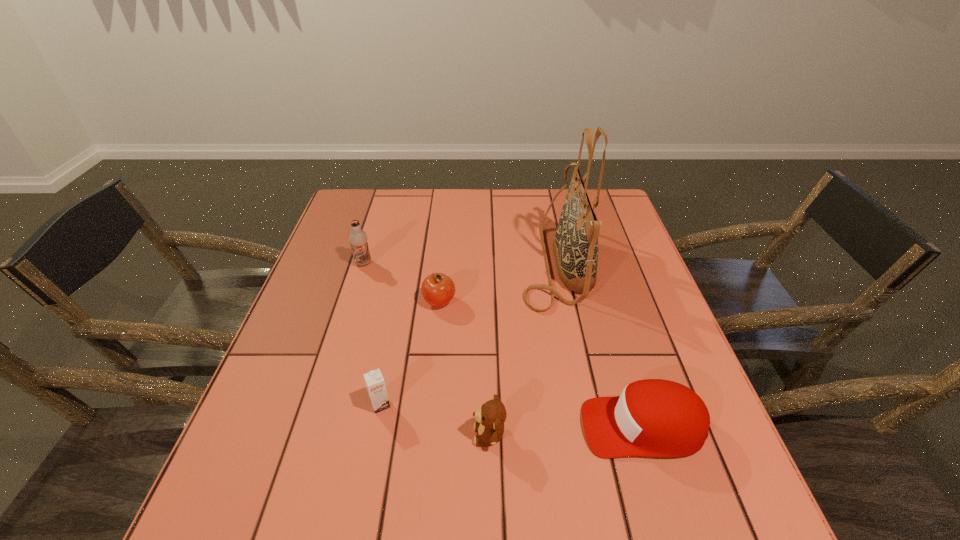
Find the location of a particular element. vacant space located on the front-facing side of the tallest object is located at coordinates (502, 262).

The image size is (960, 540). Identify the location of vacant position located 0.090m on the back of the farther chocolate milk. point(372,239).

Find the location of `vacant space situated on the back of the apple`. vacant space situated on the back of the apple is located at coordinates (444, 249).

The width and height of the screenshot is (960, 540). Find the location of `vacant point located on the front-facing side of the baseball cap`. vacant point located on the front-facing side of the baseball cap is located at coordinates 475,427.

You are a GUI agent. You are given a task and a screenshot of the screen. Output one action in this format:
    pyautogui.click(x=<x>, y=<y>)
    Task: Click on the free space located on the front-facing side of the baseball cap
    The height and width of the screenshot is (540, 960).
    Given the screenshot: What is the action you would take?
    pyautogui.click(x=439, y=427)

This screenshot has width=960, height=540. In order to click on free region located on the front-facing side of the baseball cap in this screenshot , I will do `click(393, 427)`.

Where is `free space located 0.110m on the face of the teddy bear`? Image resolution: width=960 pixels, height=540 pixels. free space located 0.110m on the face of the teddy bear is located at coordinates (416, 435).

I want to click on vacant position located on the face of the teddy bear, so click(353, 435).

The image size is (960, 540). In order to click on free spot located on the face of the teddy bear in this screenshot , I will do `click(442, 435)`.

This screenshot has height=540, width=960. What are the coordinates of `vacant space located on the back of the right chocolate milk` in the screenshot? It's located at (404, 281).